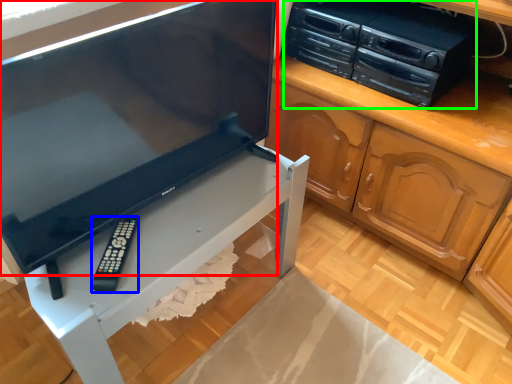
Question: Which object is positioned closest to television (highlighted by a red box)? Select from remote (highlighted by a blue box) and home appliance (highlighted by a green box).

Choices:
 (A) remote
 (B) home appliance

Answer: (A)